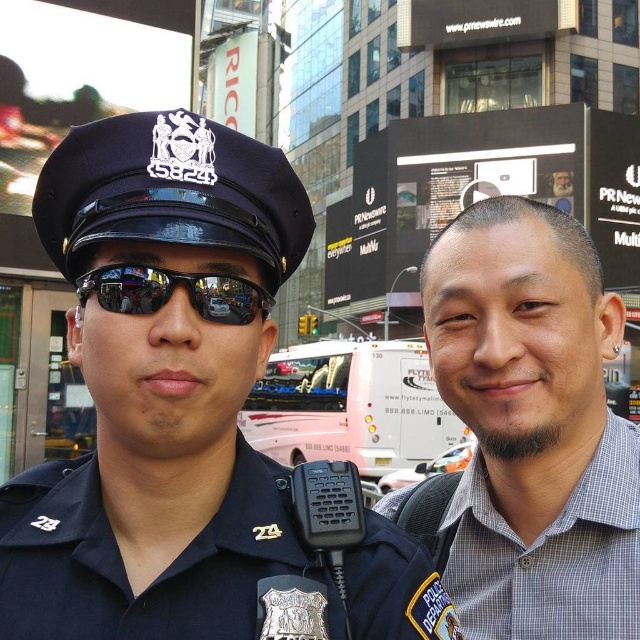
Question: Among these points, which one is nearest to the camera?

Choices:
 (A) (202, 301)
 (B) (240, 480)
 (C) (150, 554)

Answer: (C)

Question: Which point is closer to the camera taking this photo?

Choices:
 (A) (115, 264)
 (B) (250, 605)

Answer: (B)

Question: Can you confirm if gray checkered shirt at right is positioned to the left of dark blue fabric police uniform at center?

Choices:
 (A) no
 (B) yes

Answer: (A)

Question: Is blue uniform at left to the right of sunglasses at center from the viewer's perspective?

Choices:
 (A) no
 (B) yes

Answer: (A)

Question: Is gray checkered shirt at right further to the viewer compared to dark blue fabric police uniform at center?

Choices:
 (A) yes
 (B) no

Answer: (A)

Question: Which of the following is the farthest from the observer?

Choices:
 (A) click(205, 612)
 (B) click(83, 284)
 (C) click(150, 193)

Answer: (B)